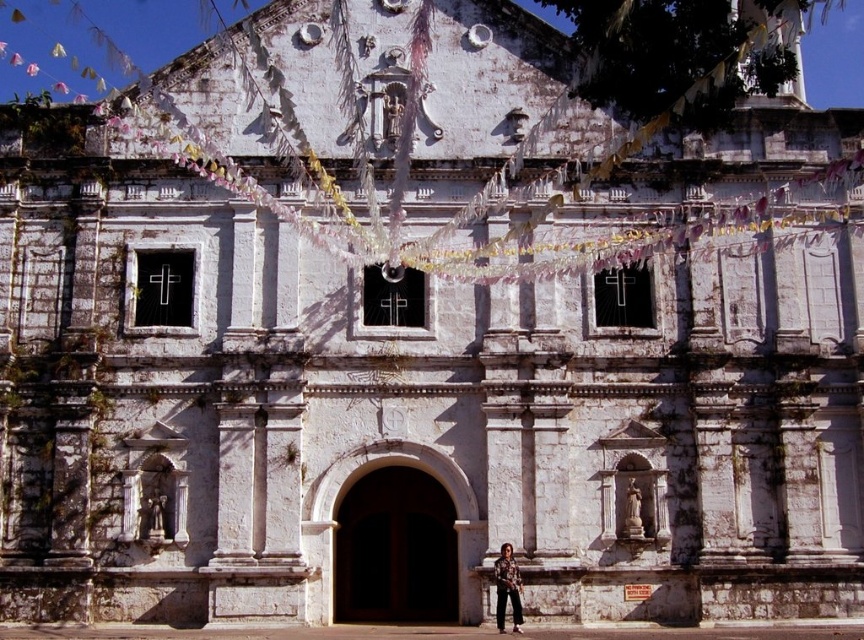
You are standing in front of the historic stone church and want to locate two specific points marked on the facade. The first point is at coordinates point (338, 506) and the second is at point (500, 579). Which point is closer to the viewer?

Point (500, 579) is closer to the viewer because point (338, 506) is behind it.